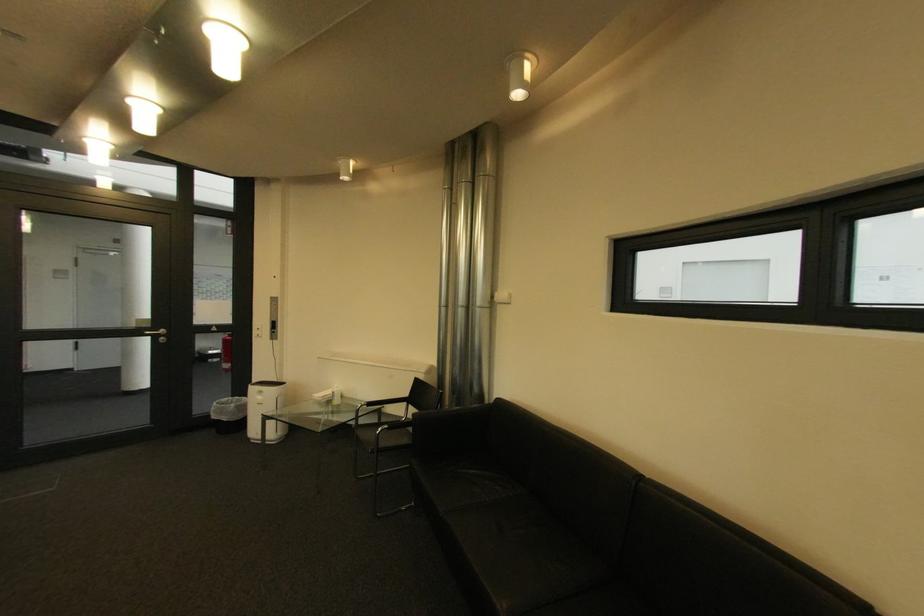
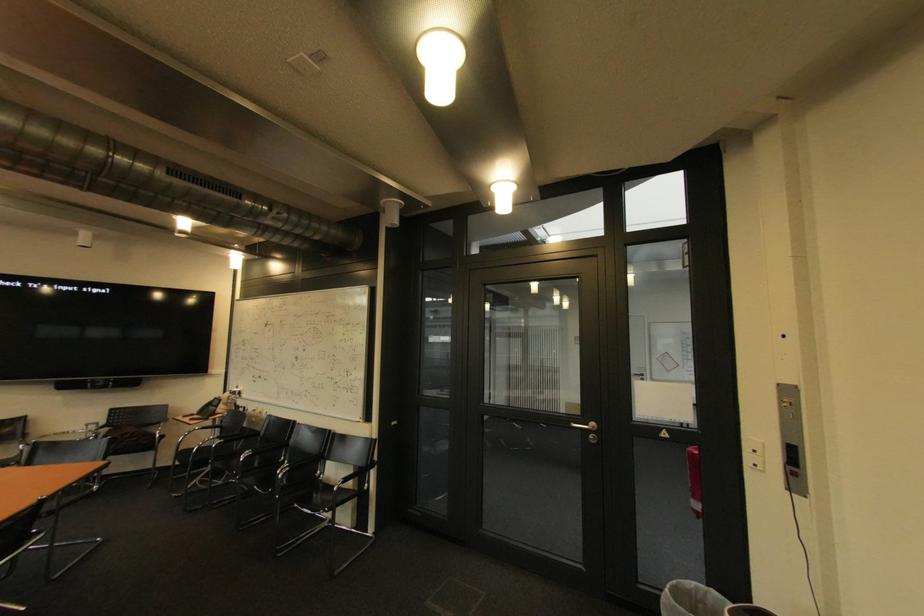
In the second image, find the point that corresponds to (235,400) in the first image.

(701, 585)